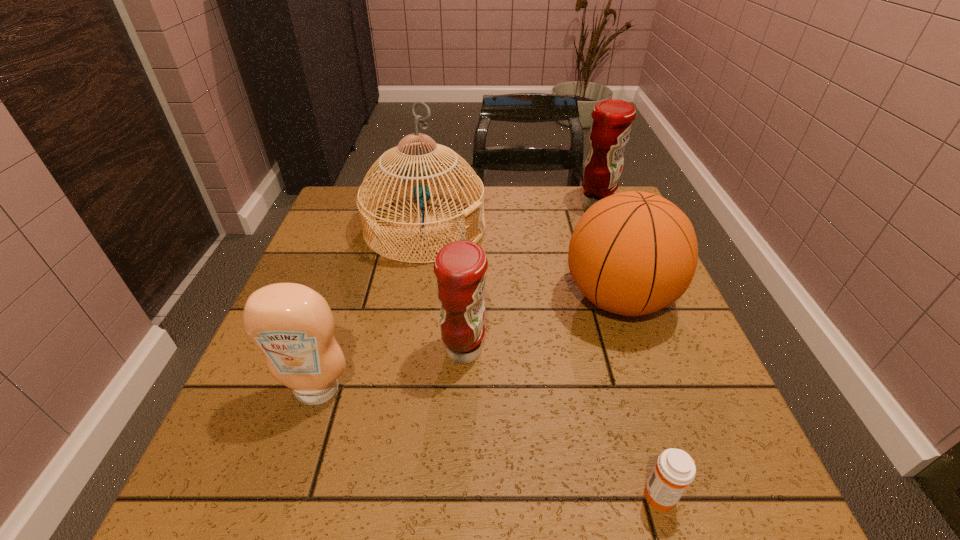
Image resolution: width=960 pixels, height=540 pixels. I want to click on vacant area that lies between the birdcage and the rightmost condiment, so click(511, 216).

At what (x,y) coordinates should I click in order to perform the action: click on unoccupied position between the shortest object and the tallest condiment. Please return your answer as a coordinate pair (x, y). This screenshot has height=540, width=960. Looking at the image, I should click on (629, 350).

In order to click on free space between the birdcage and the farthest condiment in this screenshot , I will do `click(511, 216)`.

This screenshot has width=960, height=540. What are the coordinates of `object that stands as the second closest to the leftmost condiment` in the screenshot? It's located at (414, 170).

This screenshot has height=540, width=960. I want to click on object that is the closest one to the birdcage, so 632,253.

Image resolution: width=960 pixels, height=540 pixels. I want to click on condiment object that ranks as the second closest to the tallest condiment, so click(293, 326).

Locate which condiment ranks in proximity to the second condiment from left to right. Please provide its 2D coordinates. Your answer should be formatted as a tuple, i.e. [(x, y)], where the tuple contains the x and y coordinates of a point satisfying the conditions above.

[(293, 326)]

Identify the location of vacant point that satisfies the following two spatial constraints: 1. on the back side of the second condiment from left to right; 2. on the left side of the tallest condiment. The height and width of the screenshot is (540, 960). (469, 205).

The image size is (960, 540). I want to click on vacant space that satisfies the following two spatial constraints: 1. on the back side of the basketball; 2. on the left side of the second condiment from left to right, so click(x=466, y=299).

Locate an element on the screen. This screenshot has width=960, height=540. free space that satisfies the following two spatial constraints: 1. on the back side of the basketball; 2. on the left side of the second condiment from right to left is located at coordinates (466, 299).